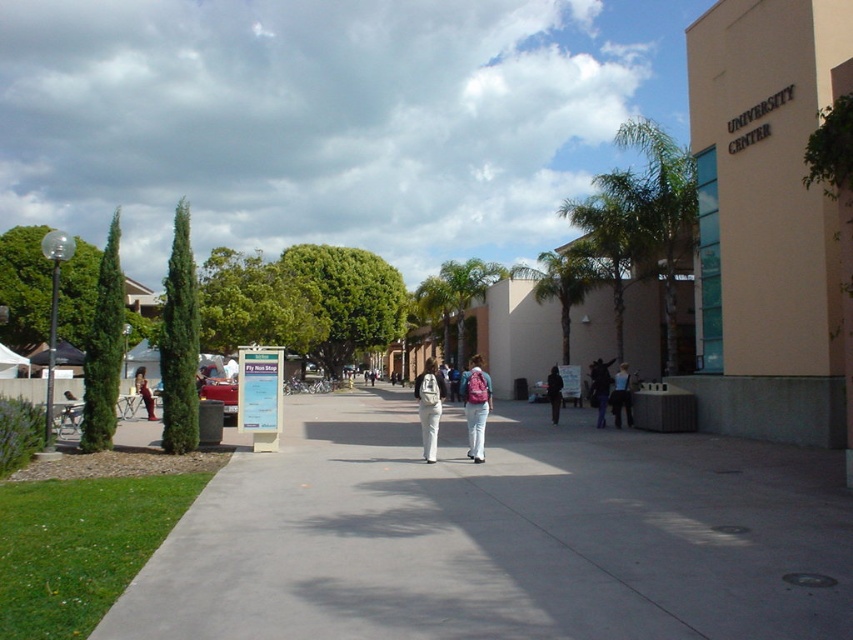
Does green leafy palm tree at center-right have a greater width compared to dark blue backpack at center?

Yes.

Does green leafy palm tree at center-right appear under dark blue backpack at center?

No.

Where is `green leafy palm tree at center-right`? green leafy palm tree at center-right is located at coordinates (608, 248).

Does green leafy palm tree at center-right come behind white matte backpack at center?

Yes, green leafy palm tree at center-right is behind white matte backpack at center.

Who is more forward, (614, 344) or (433, 362)?

Point (614, 344) is more forward.

Where is `green leafy palm tree at center-right`? Image resolution: width=853 pixels, height=640 pixels. green leafy palm tree at center-right is located at coordinates (608, 248).

Is dark blue jeans at center below denim jacket at left?

Correct, dark blue jeans at center is located below denim jacket at left.

Who is positioned more to the left, dark blue jeans at center or denim jacket at left?

Positioned to the left is denim jacket at left.

Who is more forward, (599, 413) or (152, 412)?

Point (599, 413)

Where is `dark blue jeans at center`? dark blue jeans at center is located at coordinates (599, 387).